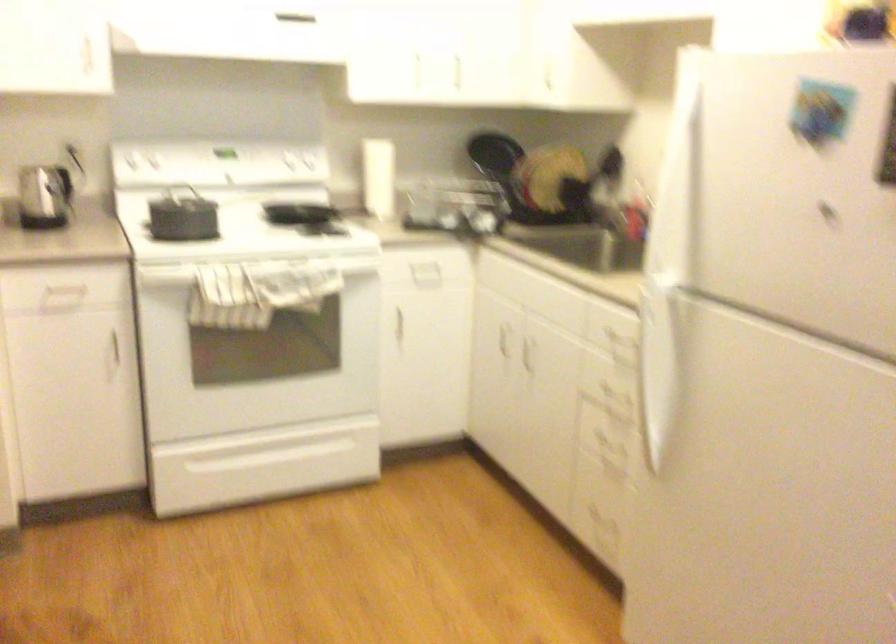
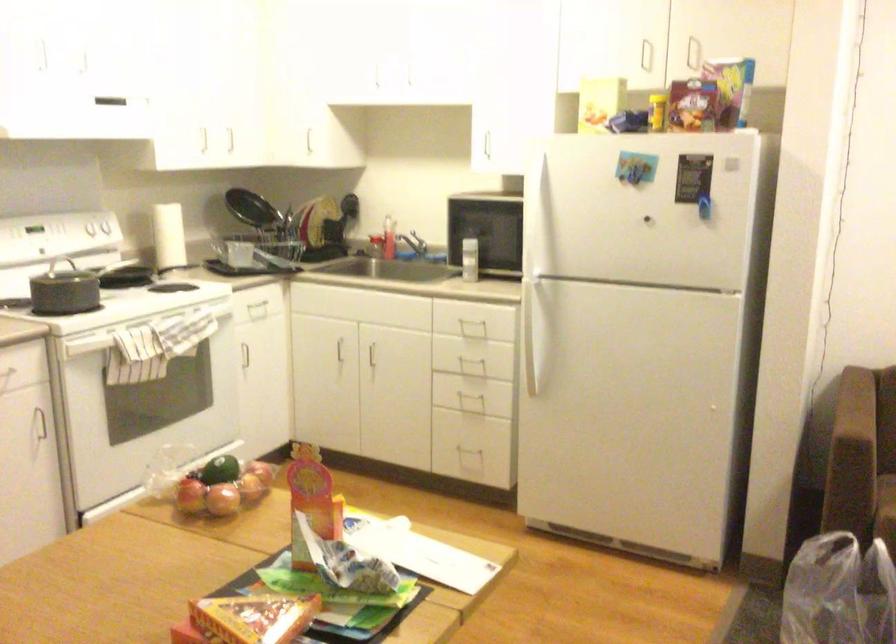
Where in the second image is the point corresponding to point 277,158 from the first image?

(98, 232)